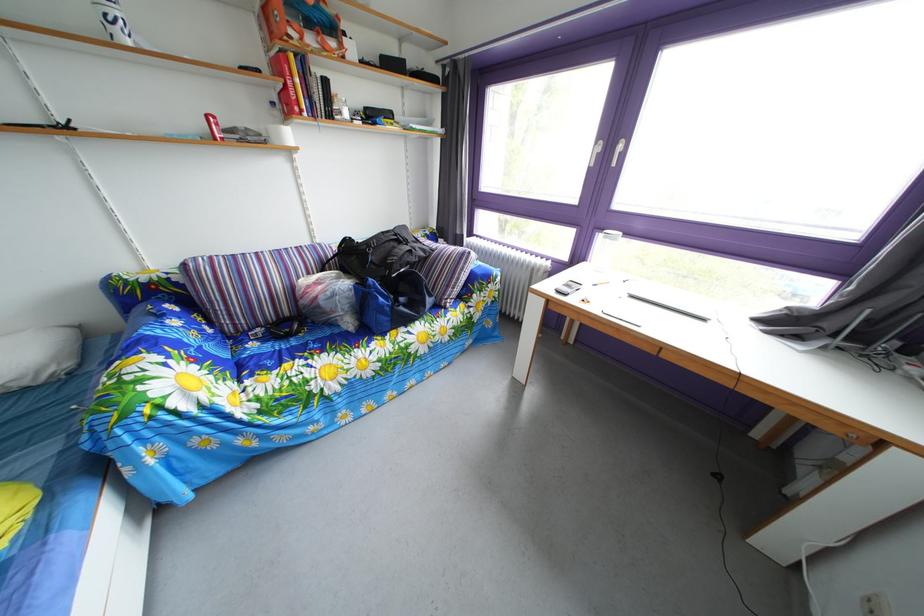
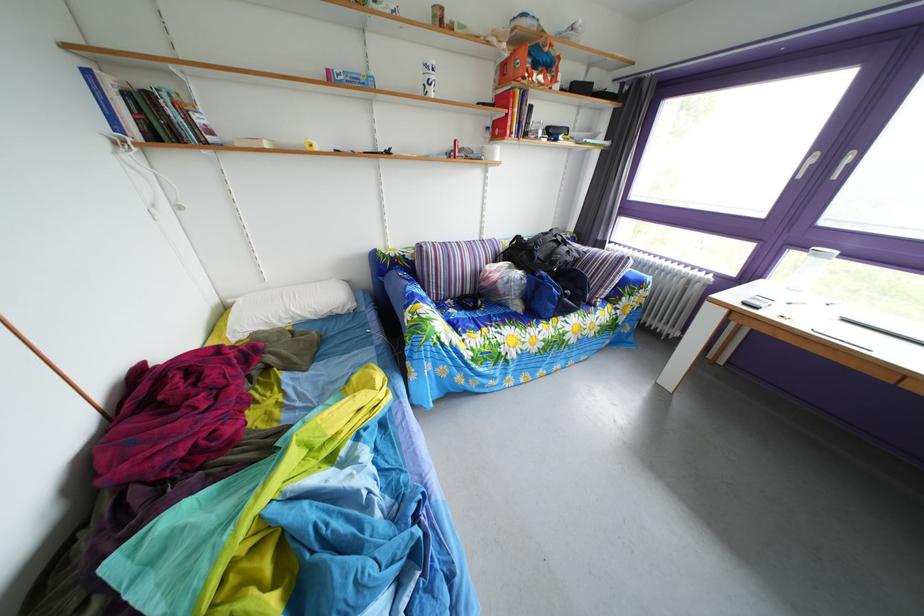
The point at (360, 265) is marked in the first image. Where is the corresponding point in the second image?

(529, 261)